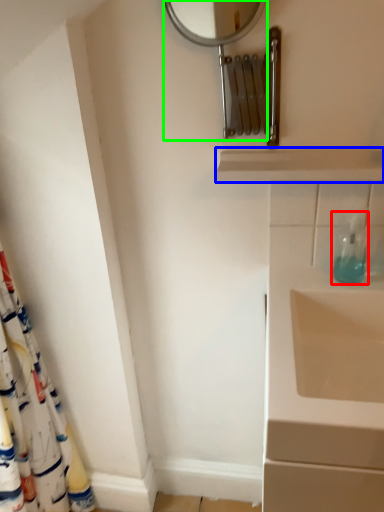
Question: Estimate the real-world distances between objects in this image. Which object is closer to soap dispenser (highlighted by a red box), balustrade (highlighted by a blue box) or mirror (highlighted by a green box)?

Choices:
 (A) balustrade
 (B) mirror

Answer: (A)